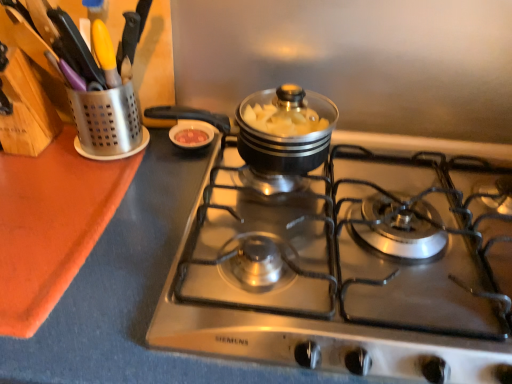
This screenshot has width=512, height=384. What do you see at coordinates (322, 294) in the screenshot?
I see `stainless steel gas stove at center` at bounding box center [322, 294].

The height and width of the screenshot is (384, 512). What are the coordinates of `stainless steel gas stove at center` in the screenshot? It's located at (322, 294).

The image size is (512, 384). Find the location of `stainless steel gas stove at center`. stainless steel gas stove at center is located at coordinates (322, 294).